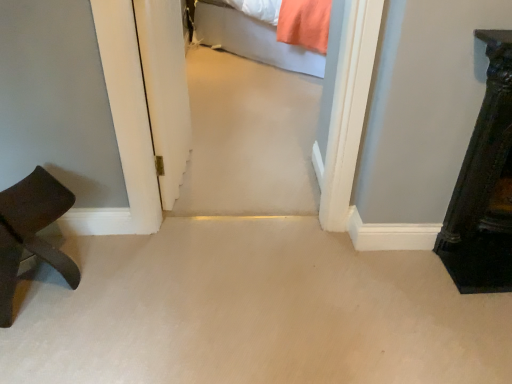
Where is `free region under transparent glass door at center (from a real-world perspective)`? free region under transparent glass door at center (from a real-world perspective) is located at coordinates click(x=185, y=175).